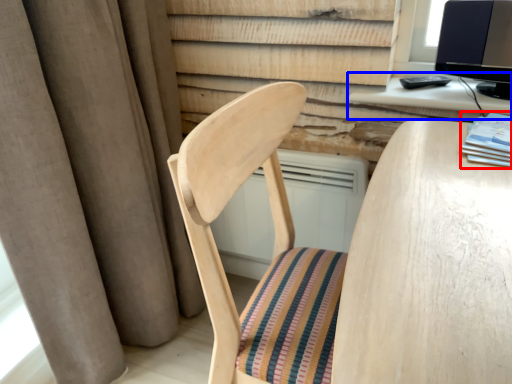
Question: Which object appears closest to the camera in this image, book (highlighted by a red box) or computer desk (highlighted by a blue box)?

Choices:
 (A) book
 (B) computer desk

Answer: (A)